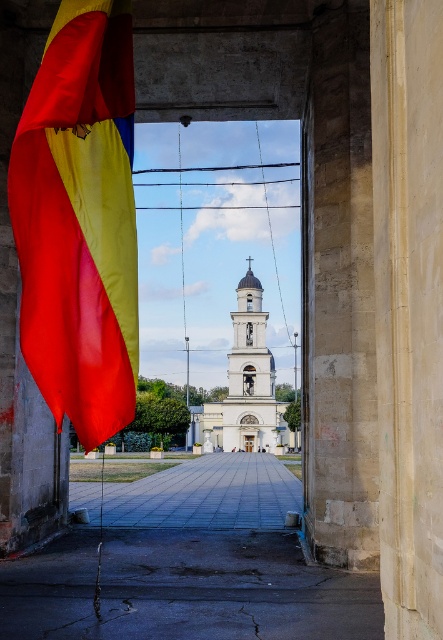
Is point (93, 467) farther from viewer compared to point (225, 404)?

No.

Is point (217, 500) farther from camera compared to point (252, 384)?

No, it is in front of (252, 384).

Where is `paved stone alley at center`? The height and width of the screenshot is (640, 443). paved stone alley at center is located at coordinates (205, 493).

What do you see at coordinates (80, 220) in the screenshot? The image size is (443, 640). I see `matte fabric flag at left` at bounding box center [80, 220].

Which is behind, point (58, 113) or point (264, 406)?

The point (264, 406) is more distant.

Who is more distant from viewer, (125,84) or (208,413)?

The point (208,413) is behind.

Image resolution: width=443 pixels, height=640 pixels. Find the location of `matte fabric flag at left`. matte fabric flag at left is located at coordinates (80, 220).

Does point (62, 374) come closer to viewer compared to point (73, 508)?

Yes, it is.

Who is more forward, [15,196] or [236,525]?

Point [15,196]

Is point (50, 148) behind point (226, 493)?

No.

At what (x,y) coordinates should I click in order to perform the action: click on matte fabric flag at left. Please return your answer as a coordinate pair (x, y). Image resolution: width=443 pixels, height=640 pixels. Looking at the image, I should click on (80, 220).